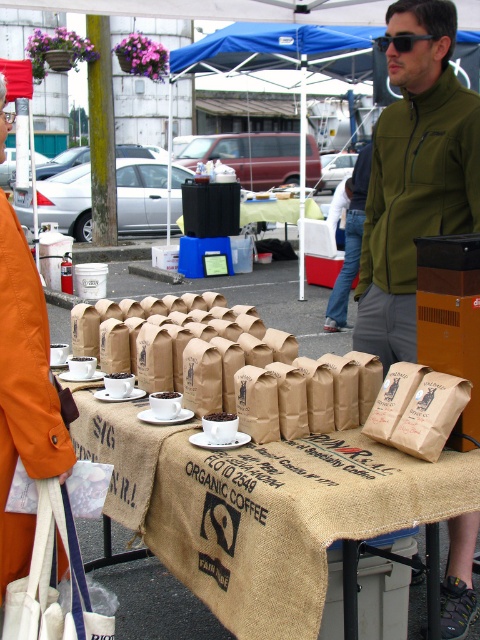
You are a vendor at the coffee stall and need to place a new sign that is 1 meter wide. The sign must be placed between the green fleece jacket at center and the orange fabric bag at lower left. Will the space between them be sufficient for the sign?

The green fleece jacket at center is wider than the orange fabric bag at lower left, but the description does not provide the exact distance between them. Therefore, it is unclear if the space between them is sufficient for a 1 meter wide sign.

You are setting up a display at the coffee stall and need to place a green fleece jacket at center and a matte brown coffee cup at center on the table. Since space is limited, which item should you adjust to make more room?

The green fleece jacket at center is wider than the matte brown coffee cup at center, so you should adjust the position of the green fleece jacket at center to make more room.